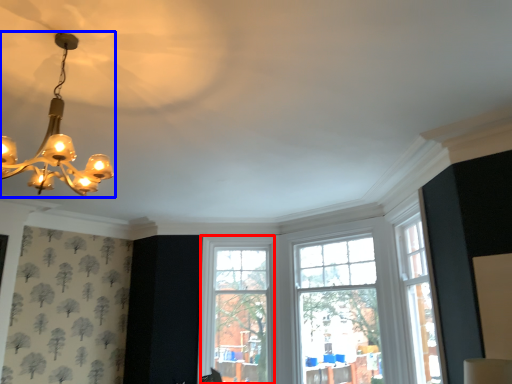
Question: Which object appears closest to the camera in this image, window (highlighted by a red box) or lamp (highlighted by a blue box)?

Choices:
 (A) window
 (B) lamp

Answer: (B)